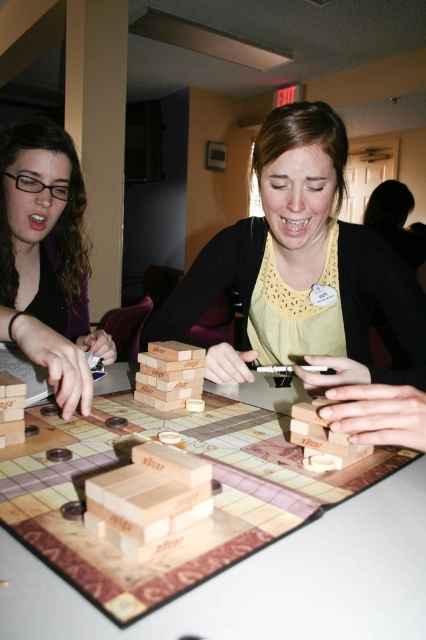
Can you confirm if matte wood blocks at center is wider than matte black hair at left?

Indeed, matte wood blocks at center has a greater width compared to matte black hair at left.

Who is higher up, matte wood blocks at center or matte black hair at left?

matte wood blocks at center

Does point (419, 320) come behind point (34, 284)?

No.

Find the location of a particular element. matte wood blocks at center is located at coordinates (302, 257).

Looking at this image, between wooden game board at center and matte wood blocks at center, which one has more height?

With more height is matte wood blocks at center.

Does wooden game board at center appear on the right side of matte wood blocks at center?

No, wooden game board at center is not to the right of matte wood blocks at center.

This screenshot has height=640, width=426. Identify the location of wooden game board at center. (264, 582).

Is wooden game board at center closer to camera compared to matte black hair at left?

Yes, wooden game board at center is closer to the viewer.

Where is `wooden game board at center`? wooden game board at center is located at coordinates (264, 582).

This screenshot has width=426, height=640. I want to click on wooden game board at center, so click(x=264, y=582).